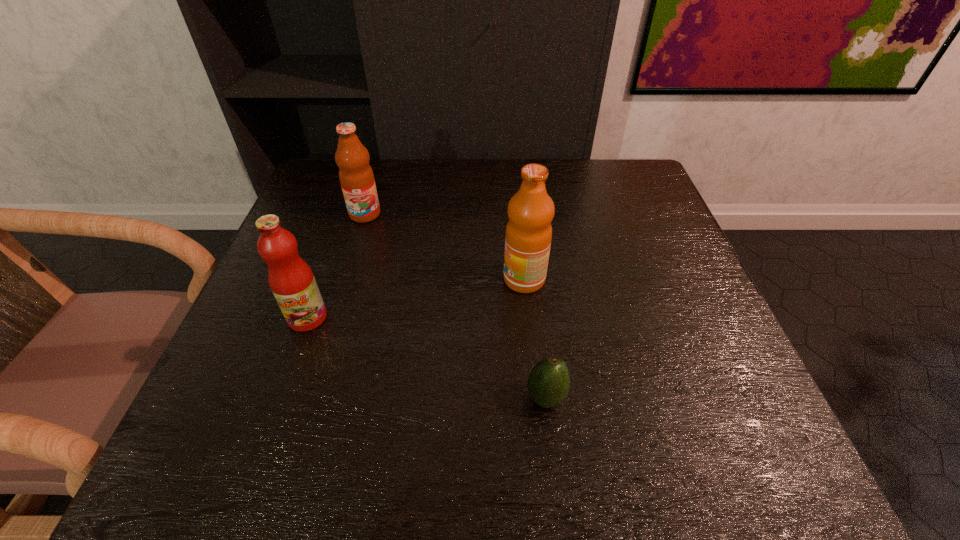
Locate which object ranks second in proximity to the farthest fruit juice. Please provide its 2D coordinates. Your answer should be formatted as a tuple, i.e. [(x, y)], where the tuple contains the x and y coordinates of a point satisfying the conditions above.

[(528, 236)]

Select which fruit juice is the closest to the farthest fruit juice. Please provide its 2D coordinates. Your answer should be formatted as a tuple, i.e. [(x, y)], where the tuple contains the x and y coordinates of a point satisfying the conditions above.

[(292, 282)]

Locate which fruit juice ranks in proximity to the rightmost fruit juice. Please provide its 2D coordinates. Your answer should be formatted as a tuple, i.e. [(x, y)], where the tuple contains the x and y coordinates of a point satisfying the conditions above.

[(356, 176)]

Image resolution: width=960 pixels, height=540 pixels. I want to click on vacant space that satisfies the following two spatial constraints: 1. on the label side of the rightmost fruit juice; 2. on the back side of the nearest object, so click(x=536, y=397).

The width and height of the screenshot is (960, 540). I want to click on vacant space that satisfies the following two spatial constraints: 1. on the label side of the shortest object; 2. on the left side of the second farthest fruit juice, so click(536, 397).

At what (x,y) coordinates should I click in order to perform the action: click on free region that satisfies the following two spatial constraints: 1. on the label side of the rightmost fruit juice; 2. on the front label of the nearest fruit juice. Please return your answer as a coordinate pair (x, y). Looking at the image, I should click on (528, 318).

Locate an element on the screen. free space that satisfies the following two spatial constraints: 1. on the front label of the farthest object; 2. on the right side of the avocado is located at coordinates (309, 397).

Where is `free spot that satisfies the following two spatial constraints: 1. on the label side of the rightmost fruit juice; 2. on the front label of the third farthest object`? This screenshot has width=960, height=540. free spot that satisfies the following two spatial constraints: 1. on the label side of the rightmost fruit juice; 2. on the front label of the third farthest object is located at coordinates (528, 318).

Image resolution: width=960 pixels, height=540 pixels. I want to click on vacant space that satisfies the following two spatial constraints: 1. on the front label of the shortest object; 2. on the left side of the farthest fruit juice, so click(309, 397).

In order to click on free location that satisfies the following two spatial constraints: 1. on the label side of the rightmost fruit juice; 2. on the left side of the avocado in this screenshot , I will do `click(536, 397)`.